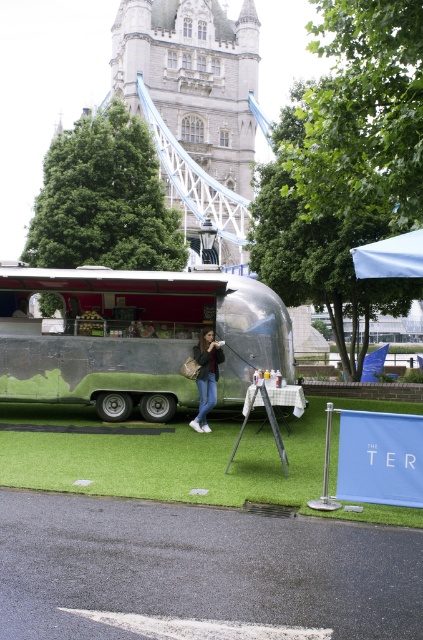
Who is more distant from viewer, (159,477) or (412,244)?

The point (159,477) is more distant.

Is green artificial turf at center to the right of white fabric canopy at upper right from the viewer's perspective?

No, green artificial turf at center is not to the right of white fabric canopy at upper right.

Locate an element on the screen. This screenshot has width=423, height=640. green artificial turf at center is located at coordinates (175, 461).

From the picture: Is silver metallic trailer at center positioned at the back of denim jeans at center?

No, it is not.

Can you confirm if silver metallic trailer at center is positioned below denim jeans at center?

No.

Is point (128, 310) behind point (208, 337)?

That is True.

At what (x,y) coordinates should I click in order to perform the action: click on silver metallic trailer at center. Please return your answer as a coordinate pair (x, y). The image size is (423, 640). Looking at the image, I should click on (136, 337).

Does silver metallic trailer at center appear on the right side of stone stonework tower bridge at upper center?

Correct, you'll find silver metallic trailer at center to the right of stone stonework tower bridge at upper center.

Based on the photo, who is shorter, silver metallic trailer at center or stone stonework tower bridge at upper center?

silver metallic trailer at center

Identify the location of silver metallic trailer at center. The height and width of the screenshot is (640, 423). (136, 337).

Locate an element on the screen. The image size is (423, 640). silver metallic trailer at center is located at coordinates pos(136,337).